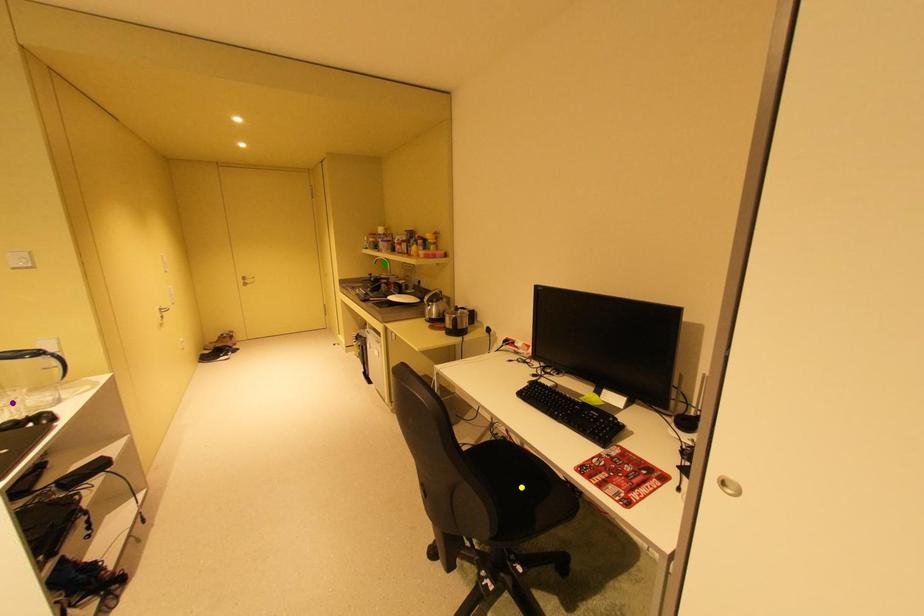
Order these from nearest to farthest:
1. yellow point
2. green point
3. purple point

purple point, yellow point, green point